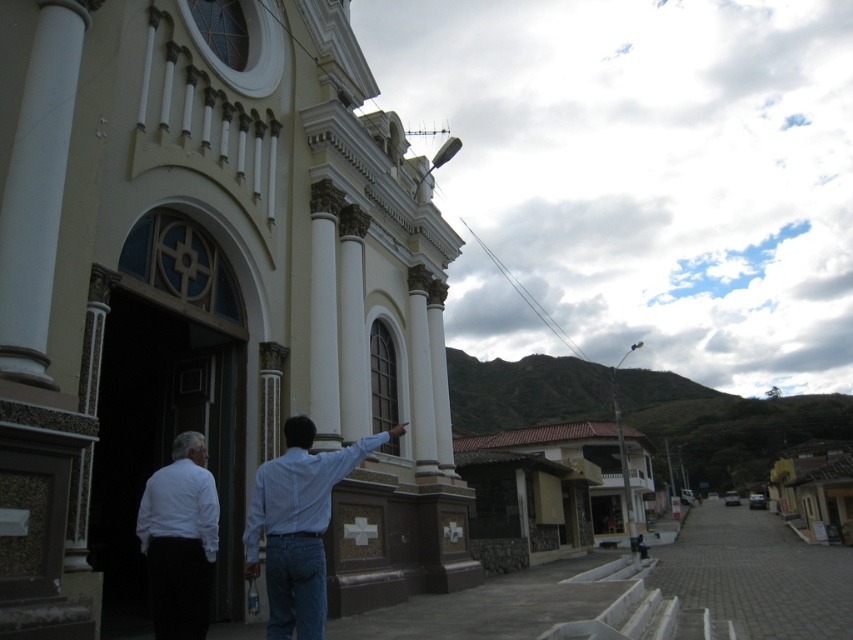
You are a photographer trying to capture both the beige stone church at center and the white matte shirt at lower left in the same frame. Considering their sizes, which object should you focus on to ensure both are clearly visible?

The beige stone church at center is larger in size than the white matte shirt at lower left. To ensure both are clearly visible, focus on the beige stone church at center as it occupies more space in the frame, allowing the smaller white matte shirt at lower left to be included without overcrowding.

You are a photographer positioned at the entrance of the church. You see the light blue shirt at center and the white matte shirt at lower left. Which person should you move towards if you want to capture both individuals in a single frame without moving the camera?

You should move towards the white matte shirt at lower left because the light blue shirt at center is already positioned to the right of it, so moving towards the left person would center both in the frame.

You are a photographer trying to capture both the light blue shirt at center and the white matte shirt at lower left in a single frame. Based on their sizes in the image, which one should you focus on first to ensure both are in focus?

The light blue shirt at center has a larger size compared to the white matte shirt at lower left, so you should focus on the light blue shirt at center first to ensure both are in focus.